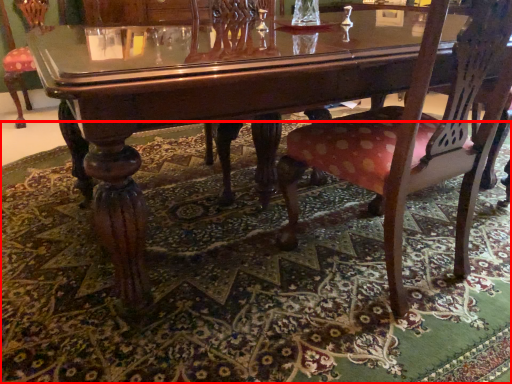
Question: Where is mat (annotated by the red box) located in relation to chair in the image?

Choices:
 (A) right
 (B) left

Answer: (B)